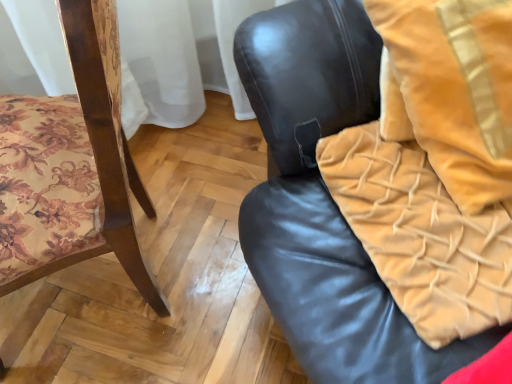
Question: Which direction should I rotate to face black leather chair at center, the first chair positioned from the right, — up or down?

Choices:
 (A) down
 (B) up

Answer: (B)

Question: Is velvet yellow blanket at right oriented towards wooden floral-patterned chair at left, placed as the 1th chair when sorted from left to right?

Choices:
 (A) yes
 (B) no

Answer: (A)

Question: Is velvet yellow blanket at right positioned behind wooden floral-patterned chair at left, placed as the 1th chair when sorted from left to right?

Choices:
 (A) no
 (B) yes

Answer: (B)

Question: Does velvet yellow blanket at right have a smaller size compared to wooden floral-patterned chair at left, placed as the 2th chair when sorted from right to left?

Choices:
 (A) yes
 (B) no

Answer: (A)

Question: Is velvet yellow blanket at right turned away from wooden floral-patterned chair at left, placed as the 2th chair when sorted from right to left?

Choices:
 (A) yes
 (B) no

Answer: (B)

Question: Considering the relative sizes of velvet yellow blanket at right and wooden floral-patterned chair at left, placed as the 2th chair when sorted from right to left, in the image provided, is velvet yellow blanket at right thinner than wooden floral-patterned chair at left, placed as the 2th chair when sorted from right to left,?

Choices:
 (A) yes
 (B) no

Answer: (A)

Question: Is velvet yellow blanket at right in front of wooden floral-patterned chair at left, placed as the 1th chair when sorted from left to right?

Choices:
 (A) yes
 (B) no

Answer: (B)

Question: Can you confirm if velvet gold throw pillow at upper right is taller than wooden floral-patterned chair at left, placed as the 1th chair when sorted from left to right?

Choices:
 (A) no
 (B) yes

Answer: (A)

Question: Is velvet gold throw pillow at upper right next to wooden floral-patterned chair at left, placed as the 1th chair when sorted from left to right, and touching it?

Choices:
 (A) no
 (B) yes

Answer: (A)

Question: Can you confirm if velvet gold throw pillow at upper right is shorter than wooden floral-patterned chair at left, placed as the 1th chair when sorted from left to right?

Choices:
 (A) no
 (B) yes

Answer: (B)

Question: From a real-world perspective, does velvet gold throw pillow at upper right sit lower than wooden floral-patterned chair at left, placed as the 1th chair when sorted from left to right?

Choices:
 (A) yes
 (B) no

Answer: (B)

Question: Is velvet gold throw pillow at upper right oriented away from wooden floral-patterned chair at left, placed as the 1th chair when sorted from left to right?

Choices:
 (A) yes
 (B) no

Answer: (B)

Question: Does velvet gold throw pillow at upper right appear on the right side of wooden floral-patterned chair at left, placed as the 2th chair when sorted from right to left?

Choices:
 (A) no
 (B) yes

Answer: (B)

Question: Is velvet yellow blanket at right next to black leather chair at center, the first chair positioned from the right, and touching it?

Choices:
 (A) yes
 (B) no

Answer: (A)